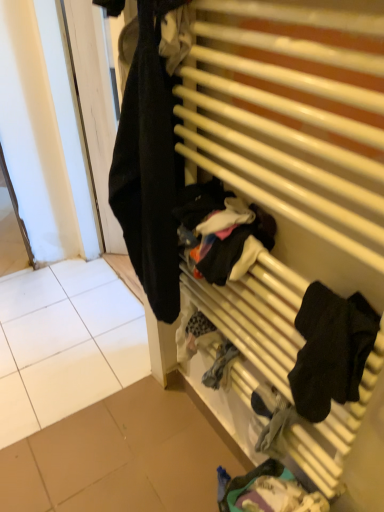
I want to click on black fabric socks at right, marked as the second clothing in a bottom-to-top arrangement, so click(x=331, y=350).

Describe the element at coordinates (331, 350) in the screenshot. I see `black fabric socks at right, marked as the second clothing in a bottom-to-top arrangement` at that location.

What do you see at coordinates (65, 343) in the screenshot? The width and height of the screenshot is (384, 512). I see `white tile at left` at bounding box center [65, 343].

Image resolution: width=384 pixels, height=512 pixels. Find the location of `black fabric socks at right, marked as the second clothing in a bottom-to-top arrangement`. black fabric socks at right, marked as the second clothing in a bottom-to-top arrangement is located at coordinates (331, 350).

Who is shorter, black fabric at left, the third clothing positioned from the bottom, or dark blue fabric at lower center, positioned as the 1th clothing in bottom-to-top order?

dark blue fabric at lower center, positioned as the 1th clothing in bottom-to-top order, is shorter.

Could you tell me if black fabric at left, which is counted as the 1th clothing, starting from the top, is facing dark blue fabric at lower center, the third clothing positioned from the top?

No, black fabric at left, which is counted as the 1th clothing, starting from the top, does not turn towards dark blue fabric at lower center, the third clothing positioned from the top.

Is the depth of black fabric at left, the third clothing positioned from the bottom, greater than that of dark blue fabric at lower center, positioned as the 1th clothing in bottom-to-top order?

No, the depth of black fabric at left, the third clothing positioned from the bottom, is less than that of dark blue fabric at lower center, positioned as the 1th clothing in bottom-to-top order.

Considering the positions of objects dark blue fabric at lower center, the third clothing positioned from the top, and black fabric socks at right, marked as the second clothing in a bottom-to-top arrangement, in the image provided, who is more to the right, dark blue fabric at lower center, the third clothing positioned from the top, or black fabric socks at right, marked as the second clothing in a bottom-to-top arrangement,?

Positioned to the right is black fabric socks at right, marked as the second clothing in a bottom-to-top arrangement.

Is point (293, 506) behind point (343, 343)?

Yes, it is.

Considering the positions of objects dark blue fabric at lower center, positioned as the 1th clothing in bottom-to-top order, and black fabric socks at right, marked as the second clothing in a bottom-to-top arrangement, in the image provided, who is behind, dark blue fabric at lower center, positioned as the 1th clothing in bottom-to-top order, or black fabric socks at right, marked as the second clothing in a bottom-to-top arrangement,?

dark blue fabric at lower center, positioned as the 1th clothing in bottom-to-top order, is behind.

How different are the orientations of dark blue fabric at lower center, the third clothing positioned from the top, and black fabric socks at right, the 2th clothing from the top, in degrees?

6.32e-05 degrees separate the facing orientations of dark blue fabric at lower center, the third clothing positioned from the top, and black fabric socks at right, the 2th clothing from the top.

Looking at this image, is wooden radiator at right inside or outside of white tile at left?

wooden radiator at right exists outside the volume of white tile at left.

Is wooden radiator at right to the left of white tile at left from the viewer's perspective?

No.

Can you confirm if wooden radiator at right is shorter than white tile at left?

No.

Does wooden radiator at right turn towards white tile at left?

No, wooden radiator at right is not turned towards white tile at left.

Is white tile at left positioned beyond the bounds of wooden radiator at right?

That's correct, white tile at left is outside of wooden radiator at right.

This screenshot has height=512, width=384. Find the location of `tile on the left of wooden radiator at right`. tile on the left of wooden radiator at right is located at coordinates (65, 343).

From the image's perspective, does white tile at left appear lower than wooden radiator at right?

Indeed, from the image's perspective, white tile at left is shown beneath wooden radiator at right.

Does white tile at left appear on the right side of wooden radiator at right?

Incorrect, white tile at left is not on the right side of wooden radiator at right.

Is dark blue fabric at lower center, positioned as the 1th clothing in bottom-to-top order, bigger than white tile at left?

No, dark blue fabric at lower center, positioned as the 1th clothing in bottom-to-top order, is not bigger than white tile at left.

Between point (262, 469) and point (29, 305), which one is positioned in front?

The point (262, 469) is in front.

Which object is closer to the camera taking this photo, dark blue fabric at lower center, the third clothing positioned from the top, or white tile at left?

dark blue fabric at lower center, the third clothing positioned from the top.

From a real-world perspective, is black fabric at left, the third clothing positioned from the bottom, below white tile at left?

No, from a real-world perspective, black fabric at left, the third clothing positioned from the bottom, is not beneath white tile at left.

Is black fabric at left, which is counted as the 1th clothing, starting from the top, completely or partially outside of white tile at left?

black fabric at left, which is counted as the 1th clothing, starting from the top, is positioned outside white tile at left.

Which object is positioned more to the right, black fabric at left, which is counted as the 1th clothing, starting from the top, or white tile at left?

From the viewer's perspective, black fabric at left, which is counted as the 1th clothing, starting from the top, appears more on the right side.

Which object is thinner, black fabric at left, which is counted as the 1th clothing, starting from the top, or white tile at left?

black fabric at left, which is counted as the 1th clothing, starting from the top, is thinner.

Is white tile at left positioned with its back to black fabric socks at right, the 2th clothing from the top?

No, white tile at left's orientation is not away from black fabric socks at right, the 2th clothing from the top.

In terms of height, does white tile at left look taller or shorter compared to black fabric socks at right, marked as the second clothing in a bottom-to-top arrangement?

Clearly, white tile at left is shorter compared to black fabric socks at right, marked as the second clothing in a bottom-to-top arrangement.

Considering the positions of point (101, 371) and point (338, 336), is point (101, 371) closer or farther from the camera than point (338, 336)?

Point (101, 371) is farther from the camera than point (338, 336).

Find the location of a particular element. This screenshot has width=384, height=512. the 2nd clothing above when counting from the dark blue fabric at lower center, positioned as the 1th clothing in bottom-to-top order (from the image's perspective) is located at coordinates (149, 166).

Locate an element on the screen. Image resolution: width=384 pixels, height=512 pixels. clothing below the black fabric socks at right, the 2th clothing from the top (from a real-world perspective) is located at coordinates (270, 492).

Looking at the image, which one is located further to wooden radiator at right, black fabric socks at right, the 2th clothing from the top, or white tile at left?

The object further to wooden radiator at right is white tile at left.

Looking at the image, which one is located further to dark blue fabric at lower center, the third clothing positioned from the top, wooden radiator at right or black fabric socks at right, the 2th clothing from the top?

wooden radiator at right lies further to dark blue fabric at lower center, the third clothing positioned from the top, than the other object.

When comparing their distances from white tile at left, does black fabric socks at right, marked as the second clothing in a bottom-to-top arrangement, or black fabric at left, the third clothing positioned from the bottom, seem further?

black fabric socks at right, marked as the second clothing in a bottom-to-top arrangement, lies further to white tile at left than the other object.

Looking at this image, estimate the real-world distances between objects in this image. Which object is further from white tile at left, dark blue fabric at lower center, the third clothing positioned from the top, or black fabric socks at right, marked as the second clothing in a bottom-to-top arrangement?

black fabric socks at right, marked as the second clothing in a bottom-to-top arrangement, lies further to white tile at left than the other object.

Estimate the real-world distances between objects in this image. Which object is further from black fabric socks at right, marked as the second clothing in a bottom-to-top arrangement, black fabric at left, which is counted as the 1th clothing, starting from the top, or wooden radiator at right?

The object further to black fabric socks at right, marked as the second clothing in a bottom-to-top arrangement, is black fabric at left, which is counted as the 1th clothing, starting from the top.

Looking at the image, which one is located closer to white tile at left, black fabric at left, which is counted as the 1th clothing, starting from the top, or dark blue fabric at lower center, positioned as the 1th clothing in bottom-to-top order?

Based on the image, dark blue fabric at lower center, positioned as the 1th clothing in bottom-to-top order, appears to be nearer to white tile at left.

From the image, which object appears to be farther from black fabric socks at right, the 2th clothing from the top, black fabric at left, which is counted as the 1th clothing, starting from the top, or dark blue fabric at lower center, positioned as the 1th clothing in bottom-to-top order?

Based on the image, dark blue fabric at lower center, positioned as the 1th clothing in bottom-to-top order, appears to be further to black fabric socks at right, the 2th clothing from the top.

Estimate the real-world distances between objects in this image. Which object is further from white tile at left, black fabric socks at right, the 2th clothing from the top, or dark blue fabric at lower center, the third clothing positioned from the top?

black fabric socks at right, the 2th clothing from the top, is further to white tile at left.

Where is `furniture between black fabric at left, which is counted as the 1th clothing, starting from the top, and dark blue fabric at lower center, the third clothing positioned from the top, in the vertical direction`? Image resolution: width=384 pixels, height=512 pixels. furniture between black fabric at left, which is counted as the 1th clothing, starting from the top, and dark blue fabric at lower center, the third clothing positioned from the top, in the vertical direction is located at coordinates (289, 158).

You are a GUI agent. You are given a task and a screenshot of the screen. Output one action in this format:
    pyautogui.click(x=<x>, y=<y>)
    Task: Click on the tile between black fabric at left, which is counted as the 1th clothing, starting from the top, and dark blue fabric at lower center, positioned as the 1th clothing in bottom-to-top order, vertically
    
    Given the screenshot: What is the action you would take?
    pyautogui.click(x=65, y=343)

Where is `furniture between black fabric at left, the third clothing positioned from the bottom, and black fabric socks at right, the 2th clothing from the top, in the vertical direction`? The width and height of the screenshot is (384, 512). furniture between black fabric at left, the third clothing positioned from the bottom, and black fabric socks at right, the 2th clothing from the top, in the vertical direction is located at coordinates (289, 158).

Find the location of a particular element. This screenshot has width=384, height=512. clothing between black fabric at left, which is counted as the 1th clothing, starting from the top, and dark blue fabric at lower center, positioned as the 1th clothing in bottom-to-top order, in the up-down direction is located at coordinates (331, 350).